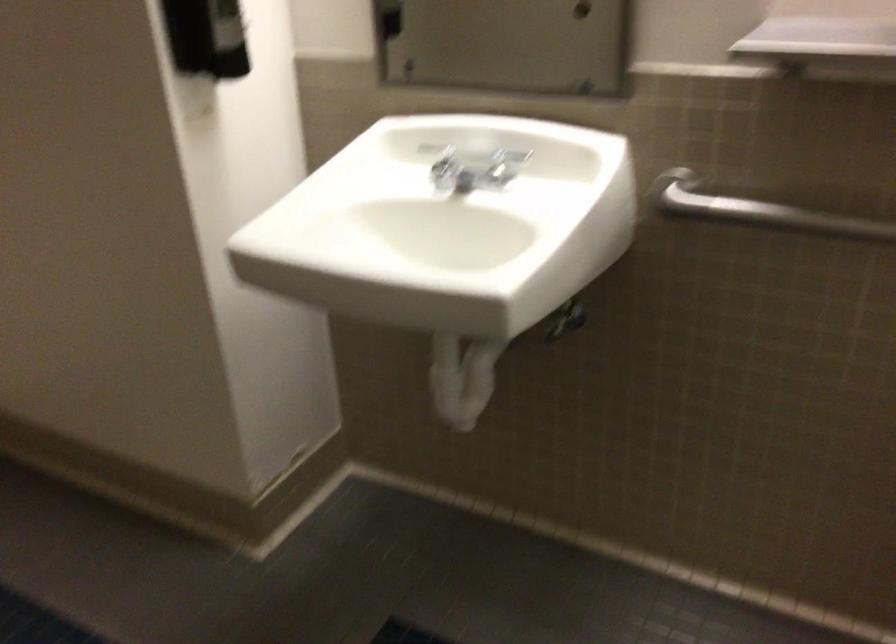
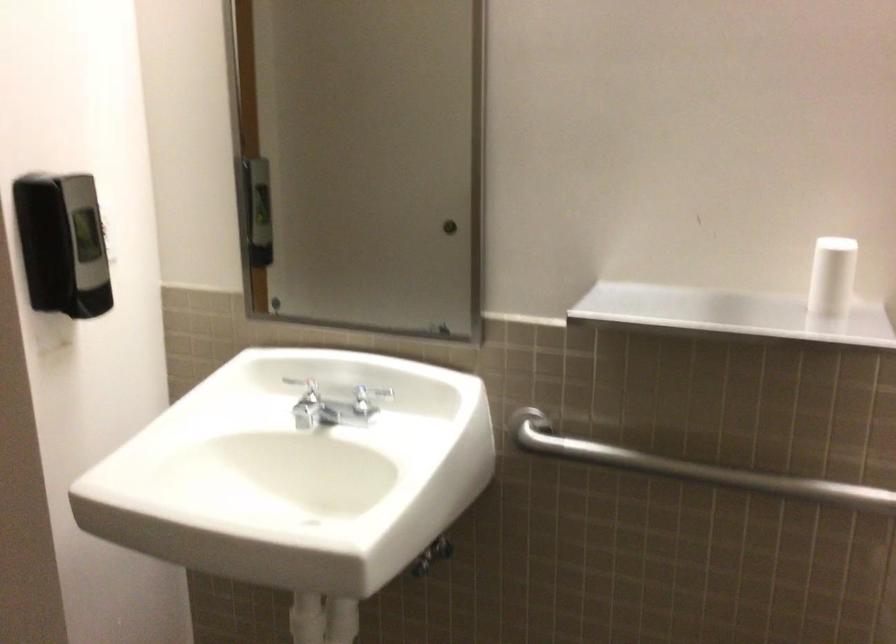
Find the pixel in the second image that matches the point at 504,164 in the first image.

(368, 397)